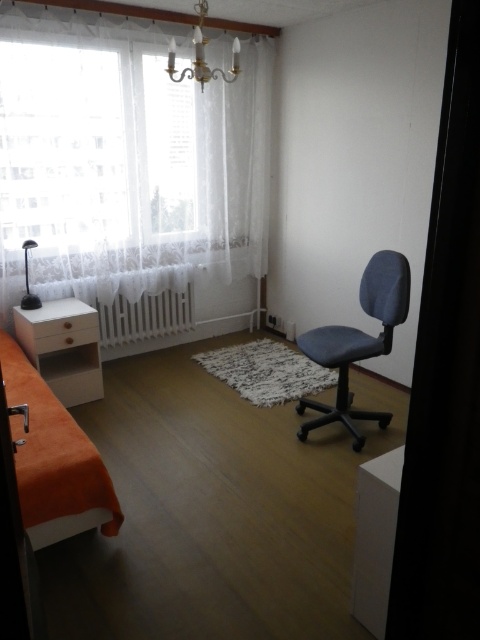
Question: Is white lace curtain at upper left positioned in front of gold metallic chandelier at upper center?

Choices:
 (A) yes
 (B) no

Answer: (B)

Question: Which object appears closest to the camera in this image?

Choices:
 (A) black plastic lamp at left
 (B) orange fabric bed at lower left
 (C) white lace curtain at upper left
 (D) white plastic radiator at center

Answer: (B)

Question: Does white plastic radiator at center have a larger size compared to gold metallic chandelier at upper center?

Choices:
 (A) no
 (B) yes

Answer: (A)

Question: Does white lace curtain at upper left have a smaller size compared to white plastic radiator at center?

Choices:
 (A) yes
 (B) no

Answer: (B)

Question: Which of these objects is positioned closest to the orange fabric bed at lower left?

Choices:
 (A) white plastic radiator at center
 (B) black plastic lamp at left
 (C) gold metallic chandelier at upper center
 (D) white lace curtain at upper left

Answer: (B)

Question: Which point is closer to the camera?

Choices:
 (A) white lace curtain at upper left
 (B) black plastic lamp at left
 (C) orange fabric bed at lower left
 (D) white plastic radiator at center

Answer: (C)